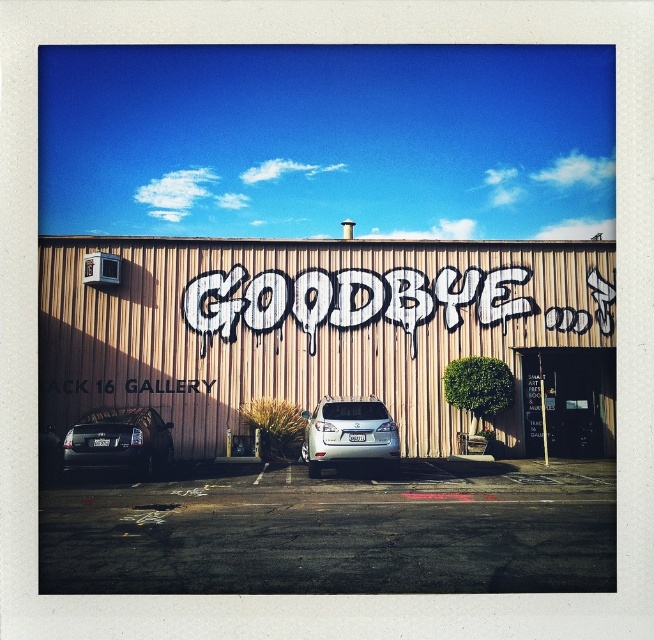
You are a photographer planning to take a picture of the white graffiti at center and the satin silver suv at center. Since the white graffiti is covering part of the suv, will you need to adjust your camera angle to fully capture both subjects without any overlap?

The white graffiti at center is positioned over the satin silver suv at center, so adjusting the camera angle would be necessary to avoid overlap and capture both subjects fully.

You are a delivery person trying to park your truck which is 2 meters tall. You see the shiny black sedan at lower left and the satin silver suv at center in the parking lot. Which parking spot between the two vehicles would allow your truck to pass through without hitting the overhead structure?

The shiny black sedan at lower left has a lesser height compared to satin silver suv at center, so the parking spot near the shiny black sedan at lower left would be safer for your truck since it is shorter and indicates lower clearance.